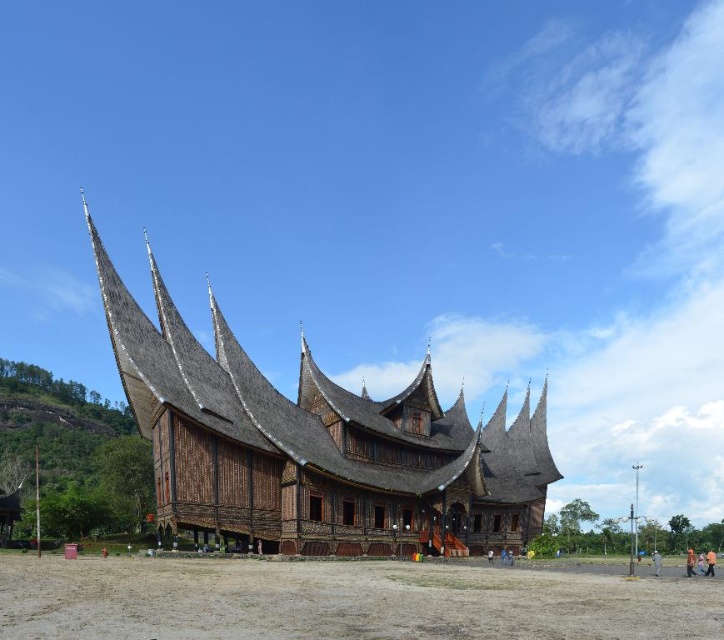
You are planning to set up a large outdoor event and need to decide where to place a 10m wide stage. Based on the image, which area between the brown wooden temple at center and the brown sandy dirt field at lower center can accommodate the stage?

The brown wooden temple at center might be wider than brown sandy dirt field at lower center, so the stage can be placed in the area of the brown wooden temple at center if it is indeed wider. However, since the exact width isn

You are standing at a distance of 300 feet from the traditional wooden structure. A guide tells you to walk towards the point marked at coordinates point (x=327, y=417). Will you need to move closer or farther away to reach that point?

The distance of point (x=327, y=417) from viewer is 342.59 feet, so you are currently 300 feet away. To reach the point, you need to move closer by 42.59 feet.